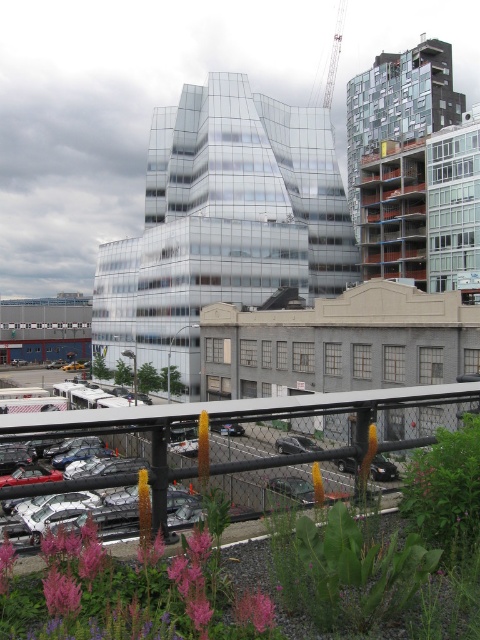
Is glassy concrete building at upper right above orange matte flower at center?

Yes.

The image size is (480, 640). What do you see at coordinates (398, 106) in the screenshot?
I see `glassy concrete building at upper right` at bounding box center [398, 106].

Image resolution: width=480 pixels, height=640 pixels. I want to click on glassy concrete building at upper right, so click(x=398, y=106).

You are a GUI agent. You are given a task and a screenshot of the screen. Output one action in this format:
    pyautogui.click(x=<x>, y=<y>)
    Task: Click on the glassy concrete building at upper right
    
    Given the screenshot: What is the action you would take?
    pyautogui.click(x=398, y=106)

You are a GUI agent. You are given a task and a screenshot of the screen. Output one action in this format:
    pyautogui.click(x=<x>, y=<y>)
    Task: Click on the shiny black sedan at center
    
    Given the screenshot: What is the action you would take?
    pyautogui.click(x=296, y=444)

Does shiny black sedan at center have a lesser height compared to orange matte flower at center?

Yes, shiny black sedan at center is shorter than orange matte flower at center.

Image resolution: width=480 pixels, height=640 pixels. What are the coordinates of `shiny black sedan at center` in the screenshot? It's located at (296, 444).

Can you confirm if glassy reflective building at center is positioned above metallic silver crane at upper center?

Actually, glassy reflective building at center is below metallic silver crane at upper center.

Does glassy reflective building at center lie behind metallic silver crane at upper center?

No, glassy reflective building at center is closer to the viewer.

Which is in front, point (179, 348) or point (332, 83)?

Point (179, 348) is more forward.

Image resolution: width=480 pixels, height=640 pixels. Identify the location of glassy reflective building at center. (223, 221).